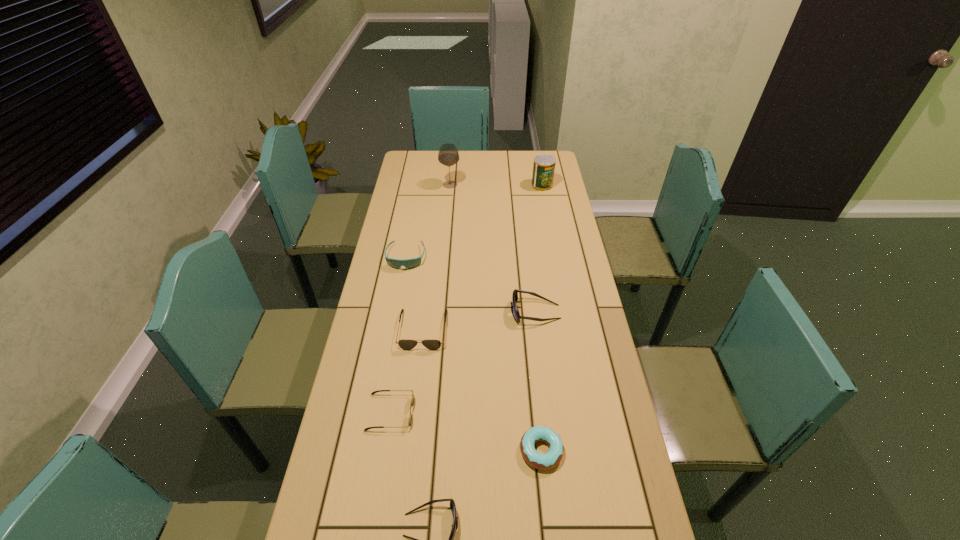
Locate an element on the screen. The width and height of the screenshot is (960, 540). vacant area that satisfies the following two spatial constraints: 1. on the front-facing side of the nearer black sunglasses; 2. on the back side of the doughnut is located at coordinates (384, 450).

I want to click on vacant space that satisfies the following two spatial constraints: 1. on the front-facing side of the bigger black sunglasses; 2. on the left side of the doughnut, so click(408, 450).